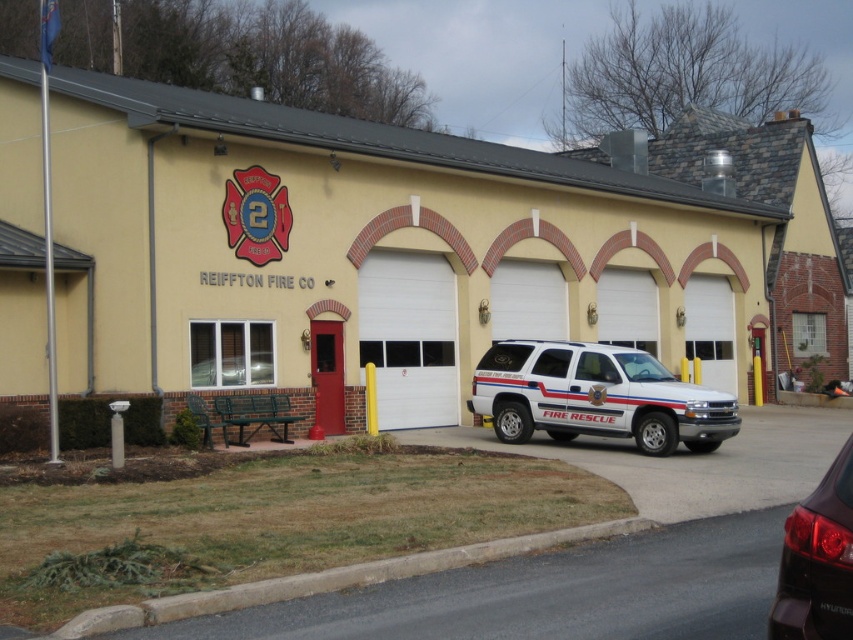
You are a visitor arriving at the fire station and need to park your car. You see a white matte fire rescue vehicle at center and a shiny black suv at lower right. Which vehicle is closer to the entrance where you arrived?

The white matte fire rescue vehicle at center is closer to the entrance because it is further to the viewer than the shiny black suv at lower right, meaning it is positioned nearer to where you are standing.

You are standing at the entrance of the REIFFTON FIRE CO 2 building. You need to locate the white matte fire rescue vehicle at center. According to the scene description, where exactly is it positioned in terms of coordinates?

The white matte fire rescue vehicle at center is positioned at coordinates point (596, 396).